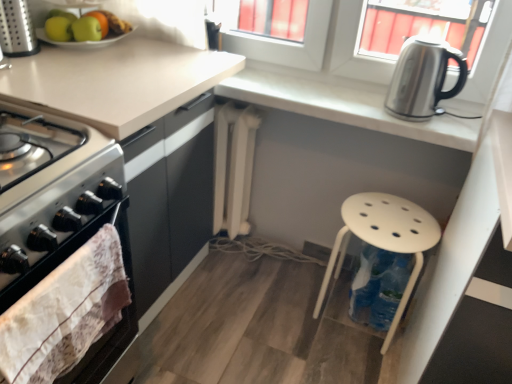
Find the location of a particular element. This screenshot has width=512, height=384. vacant area that is in front of green matte apple at upper left, the 1th apple positioned from the right is located at coordinates (81, 52).